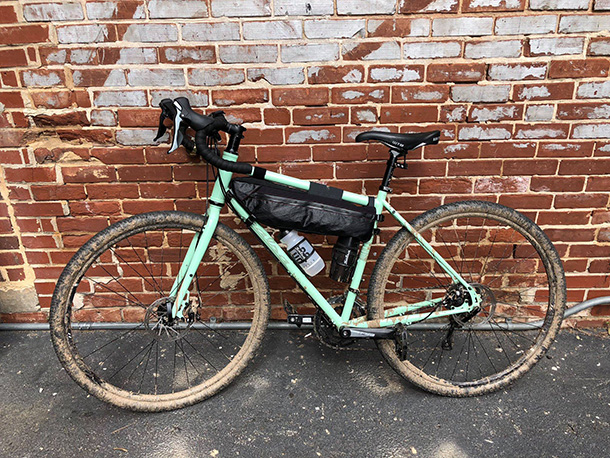
This screenshot has height=458, width=610. I want to click on seat, so click(x=398, y=140).